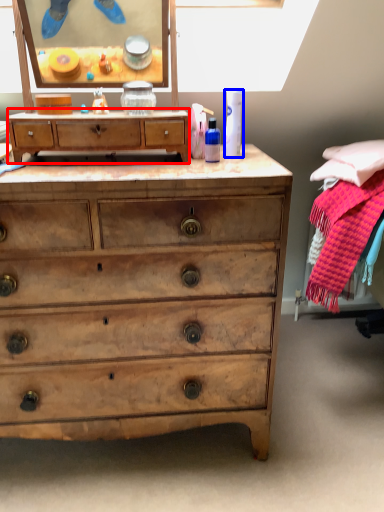
Question: Among these objects, which one is nearest to the camera, chest of drawers (highlighted by a red box) or toiletry (highlighted by a blue box)?

Choices:
 (A) chest of drawers
 (B) toiletry

Answer: (A)